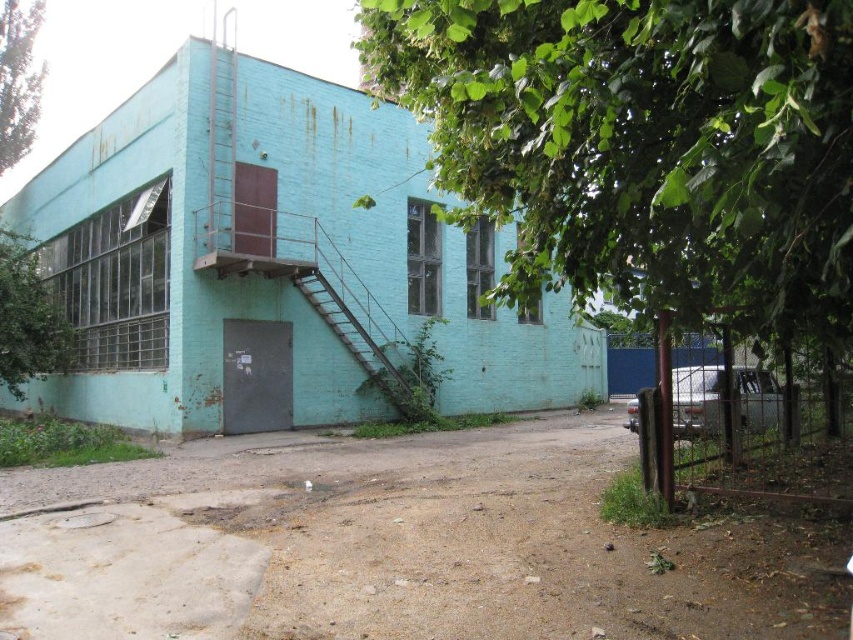
You are a delivery driver who needs to park the metallic teal car at right as close as possible to the teal painted wall at upper left. Considering the spatial arrangement, can the car be parked directly in front of the wall?

The teal painted wall at upper left is above the metallic teal car at right, meaning it is positioned higher up on the building. Since the car is on the ground level and the wall is above it, the car cannot be parked directly in front of the wall because the wall is located higher up on the building structure.

You are a delivery driver who needs to park your metallic teal car at right as close as possible to the teal painted wall at upper left. Can you safely park the car next to the wall without any obstruction?

The teal painted wall at upper left is to the left of the metallic teal car at right, so yes, you can park the metallic teal car at right next to the teal painted wall at upper left since there is no obstruction mentioned between them.

You are a painter who needs to decide which object requires more paint between the teal painted wall at upper left and the metallic teal car at right. Based on their sizes, which one would need more paint?

The teal painted wall at upper left requires more paint because its width is larger than the metallic teal car at right.